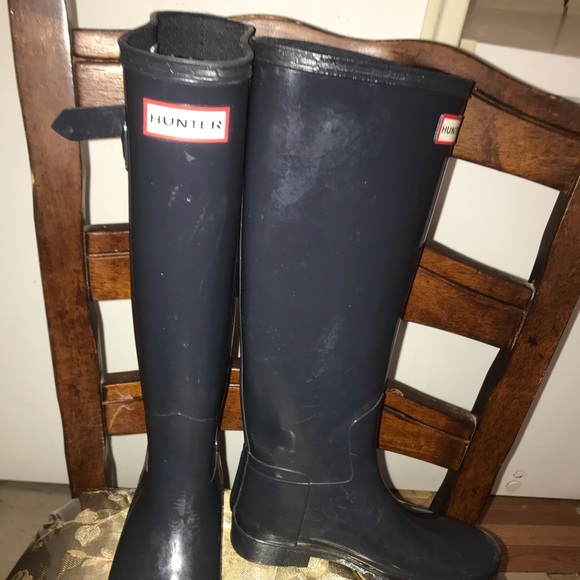
You are a GUI agent. You are given a task and a screenshot of the screen. Output one action in this format:
    pyautogui.click(x=<x>, y=<y>)
    Task: Click on the floor tiles
    The width and height of the screenshot is (580, 580).
    Given the screenshot: What is the action you would take?
    pyautogui.click(x=25, y=521)